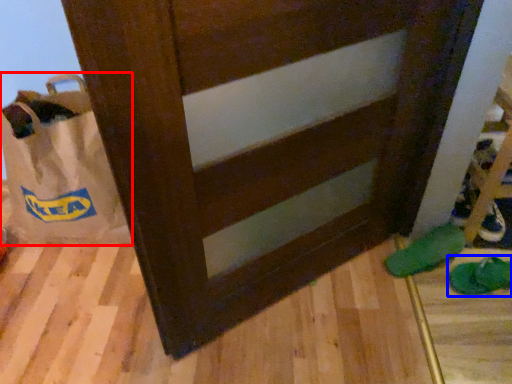
Question: Which object is further to the camera taking this photo, grocery bag (highlighted by a red box) or footwear (highlighted by a blue box)?

Choices:
 (A) grocery bag
 (B) footwear

Answer: (B)